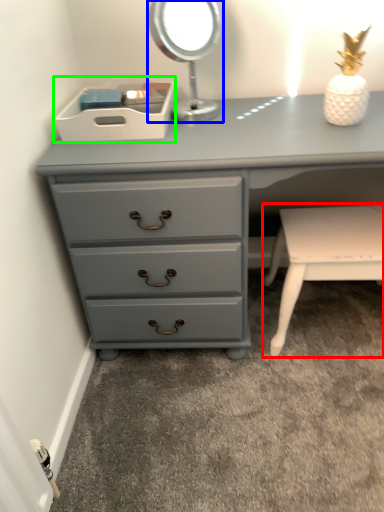
Question: Which is farther away from table (highlighted by a red box)? bedside lamp (highlighted by a blue box) or storage box (highlighted by a green box)?

Choices:
 (A) bedside lamp
 (B) storage box

Answer: (B)